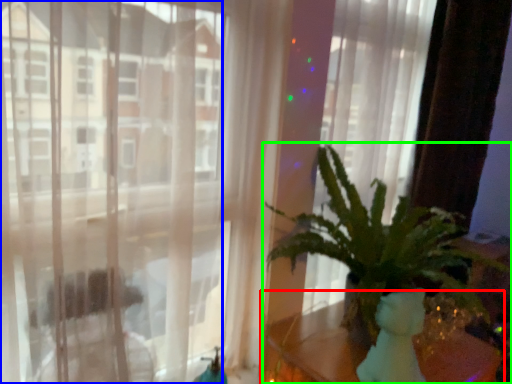
Question: Considering the real-world distances, which object is farthest from table (highlighted by a red box)? window (highlighted by a blue box) or houseplant (highlighted by a green box)?

Choices:
 (A) window
 (B) houseplant

Answer: (A)